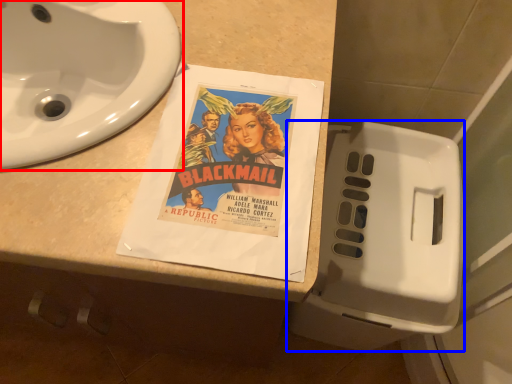
Question: Which object is further to the camera taking this photo, sink (highlighted by a red box) or toilet (highlighted by a blue box)?

Choices:
 (A) sink
 (B) toilet

Answer: (B)